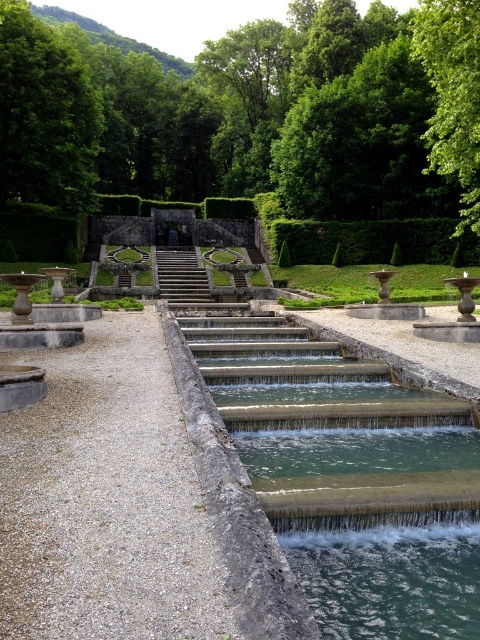
You are standing at the entrance of the garden and want to take a photo of both the green leafy tree at upper right and the stone steps at center. Which object should you position closer to the camera to ensure both are in focus?

To ensure both the green leafy tree at upper right and the stone steps at center are in focus, position the camera closer to the stone steps at center since it is shorter than the green leafy tree at upper right.

Consider the image. You are standing at the center of the garden and want to locate the green leafy tree at upper right. In which direction should you look to find it?

The green leafy tree at upper right is located at point coordinates of 0.150 on the x axis and 0.944 on the y axis. Since the x coordinate is 0.150, which is closer to the left side of the image, and the y coordinate is 0.944, which is near the top, you should look towards the upper left direction to locate it.

You are standing at the point marked as point (373, 241) in the garden. What is the nearest object to you?

The nearest object to you is the green leafy hedge at center, as the point (373, 241) corresponds to its location.